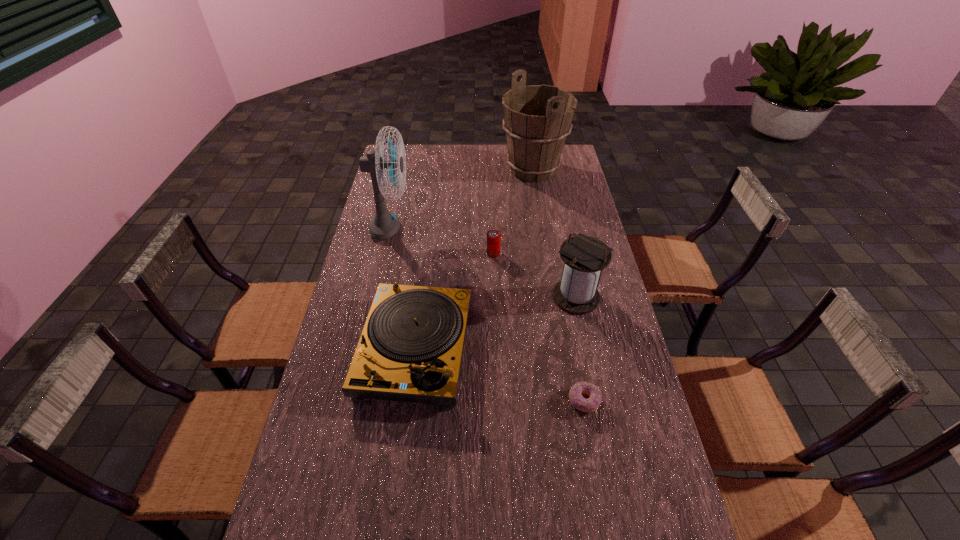
Identify which object is located as the second nearest to the can. Please provide its 2D coordinates. Your answer should be formatted as a tuple, i.e. [(x, y)], where the tuple contains the x and y coordinates of a point satisfying the conditions above.

[(410, 350)]

Locate an element on the screen. Image resolution: width=960 pixels, height=540 pixels. the fifth closest object relative to the lantern is located at coordinates (537, 119).

The image size is (960, 540). Identify the location of free space that satisfies the following two spatial constraints: 1. on the back side of the lantern; 2. on the front-facing side of the fan. (562, 230).

Locate an element on the screen. This screenshot has width=960, height=540. free point that satisfies the following two spatial constraints: 1. on the front-facing side of the fourth object from right to left; 2. on the right side of the fan is located at coordinates (385, 253).

Where is `vacant space that satisfies the following two spatial constraints: 1. on the back side of the farthest object; 2. on the right side of the can`? vacant space that satisfies the following two spatial constraints: 1. on the back side of the farthest object; 2. on the right side of the can is located at coordinates (491, 170).